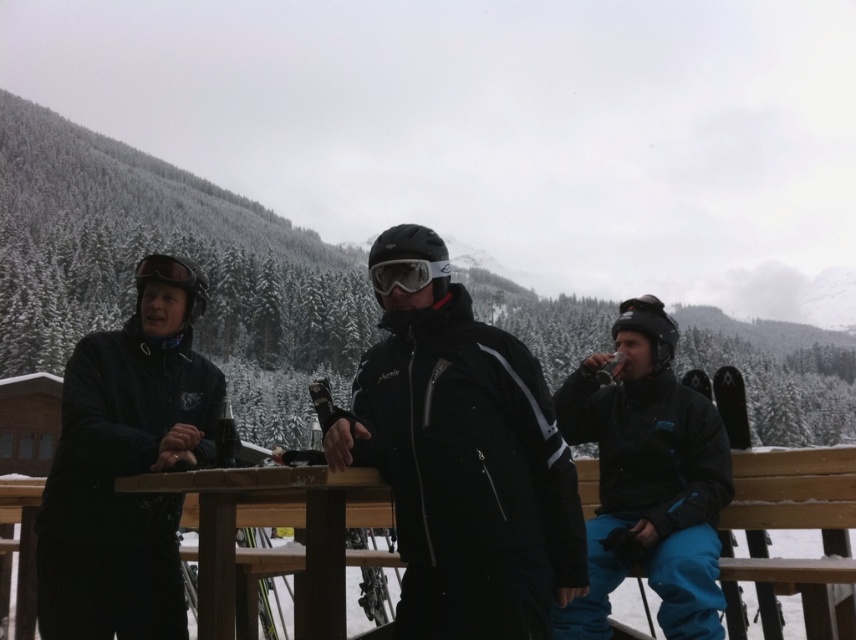
Question: Does matte black jacket at center appear under wooden picnic table at center?

Choices:
 (A) yes
 (B) no

Answer: (A)

Question: Is matte black jacket at center above matte black jacket at right?

Choices:
 (A) no
 (B) yes

Answer: (A)

Question: Which point is farther to the camera?

Choices:
 (A) matte black jacket at left
 (B) transparent plastic goggles at center

Answer: (A)

Question: Which of the following is the closest to the observer?

Choices:
 (A) (93, 449)
 (B) (673, 573)
 (C) (421, 269)

Answer: (C)

Question: Among these points, which one is nearest to the camera?

Choices:
 (A) (146, 560)
 (B) (619, 336)
 (C) (387, 381)
 (D) (375, 268)

Answer: (D)

Question: Can you confirm if matte black jacket at right is positioned below wooden picnic table at center?

Choices:
 (A) yes
 (B) no

Answer: (B)